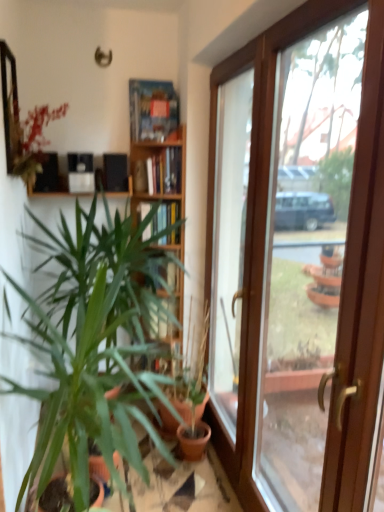
Question: Considering the relative positions of green matte plant at left, which ranks as the 2th houseplant in right-to-left order, and green matte plant at center, the 2th houseplant from the left, in the image provided, is green matte plant at left, which ranks as the 2th houseplant in right-to-left order, to the left or to the right of green matte plant at center, the 2th houseplant from the left,?

Choices:
 (A) left
 (B) right

Answer: (A)

Question: Considering the positions of green matte plant at left, which ranks as the 2th houseplant in right-to-left order, and green matte plant at center, the 2th houseplant from the left, in the image, is green matte plant at left, which ranks as the 2th houseplant in right-to-left order, bigger or smaller than green matte plant at center, the 2th houseplant from the left,?

Choices:
 (A) big
 (B) small

Answer: (A)

Question: Estimate the real-world distances between objects in this image. Which object is farther from the hardcover books at upper center, marked as the second book in a bottom-to-top arrangement?

Choices:
 (A) matte black mirror at upper left
 (B) hardcover book at center, the second book positioned from the top
 (C) clear glass door at center
 (D) green matte plant at left, positioned as the 1th houseplant in left-to-right order
 (E) green matte plant at center, arranged as the 1th houseplant when viewed from the right

Answer: (E)

Question: Which object is the farthest from the matte black mirror at upper left?

Choices:
 (A) matte black shelf at upper left
 (B) hardcover book at center, which is the first book in bottom-to-top order
 (C) brown wooden door at right
 (D) green matte plant at center, the 2th houseplant from the left
 (E) green matte plant at left, which ranks as the 2th houseplant in right-to-left order

Answer: (C)